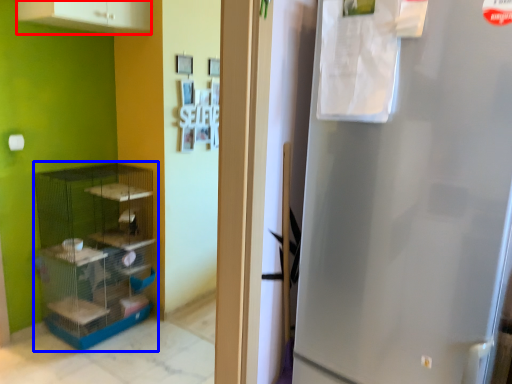
Question: Which of the following is the farthest to the observer, cabinetry (highlighted by a red box) or shelf (highlighted by a blue box)?

Choices:
 (A) cabinetry
 (B) shelf

Answer: (B)